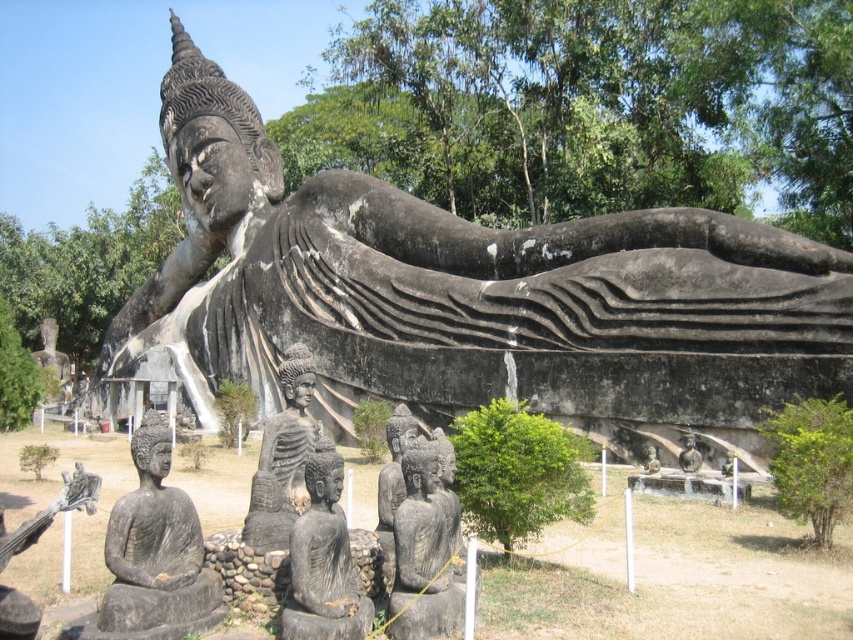
Measure the distance between point [332,544] and camera.

They are 119.64 feet apart.

Is black stone buddha at center to the right of dark gray stone statue at center from the viewer's perspective?

Incorrect, black stone buddha at center is not on the right side of dark gray stone statue at center.

Does point (329, 534) come behind point (401, 614)?

No, it is in front of (401, 614).

Find the location of a particular element. Image resolution: width=853 pixels, height=640 pixels. black stone buddha at center is located at coordinates pos(323,561).

The height and width of the screenshot is (640, 853). In order to click on dark gray stone statue at center in this screenshot , I will do `click(422, 554)`.

Is point (450, 621) closer to camera compared to point (648, 474)?

Yes, point (450, 621) is in front of point (648, 474).

Identify the location of dark gray stone statue at center. (422, 554).

Which is behind, point (694, 452) or point (653, 448)?

Point (653, 448)

In the scene shown: Is smooth gray statue at center to the right of smooth stone statue at center from the viewer's perspective?

Correct, you'll find smooth gray statue at center to the right of smooth stone statue at center.

Is point (677, 460) behind point (651, 445)?

No, (677, 460) is in front of (651, 445).

Find the location of `smooth gray statue at center`. smooth gray statue at center is located at coordinates (689, 454).